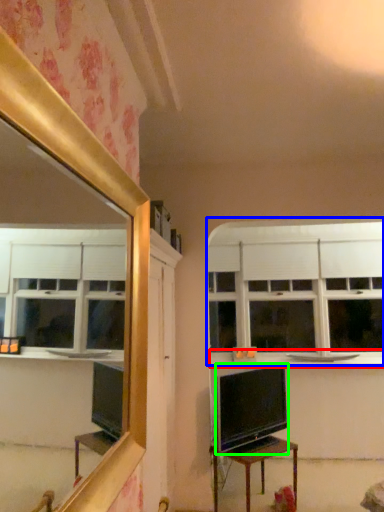
Question: Considering the real-world distances, which object is closest to counter top (highlighted by a red box)? window (highlighted by a blue box) or television (highlighted by a green box).

Choices:
 (A) window
 (B) television

Answer: (A)